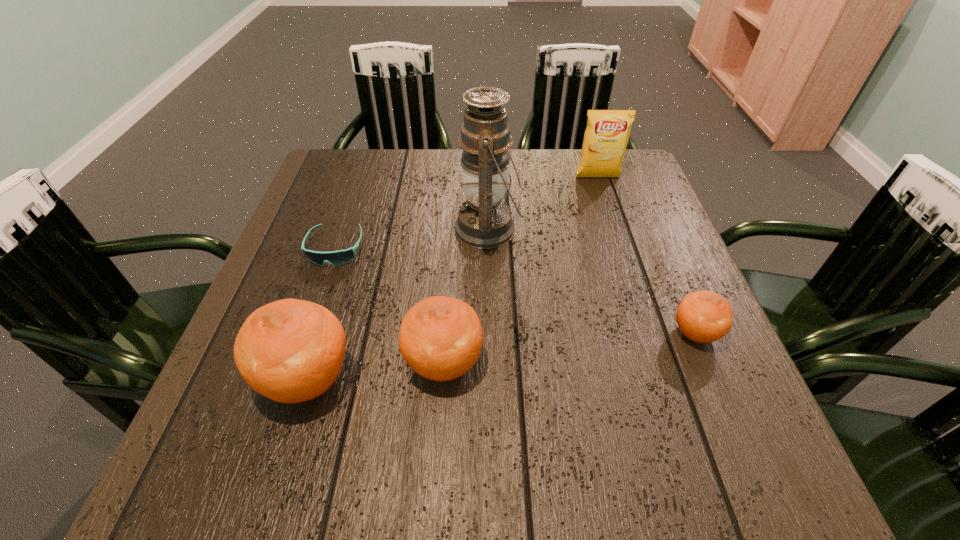
Image resolution: width=960 pixels, height=540 pixels. Find the location of `location for an additional orange_(fruit) to make spacing equal`. location for an additional orange_(fruit) to make spacing equal is located at coordinates (573, 348).